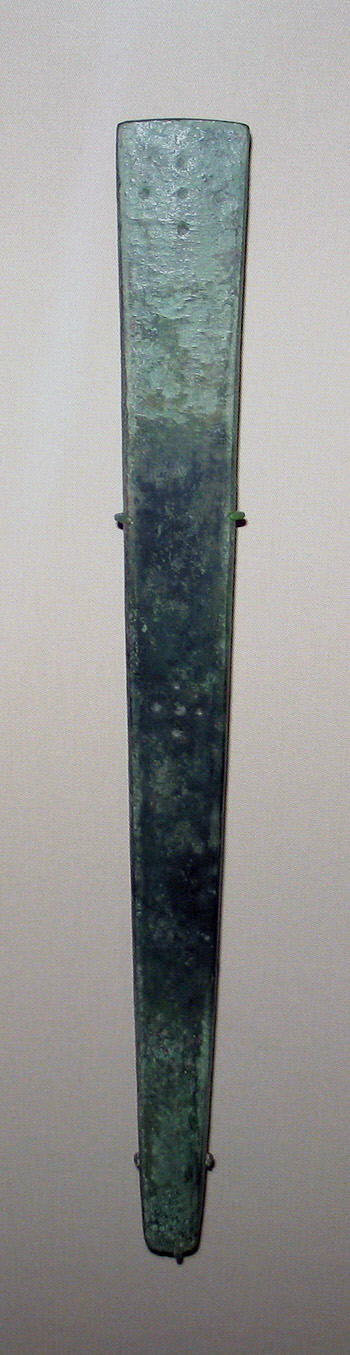
The height and width of the screenshot is (1355, 350). In order to click on brighter portion of wall above art piece in this screenshot , I will do `click(190, 60)`.